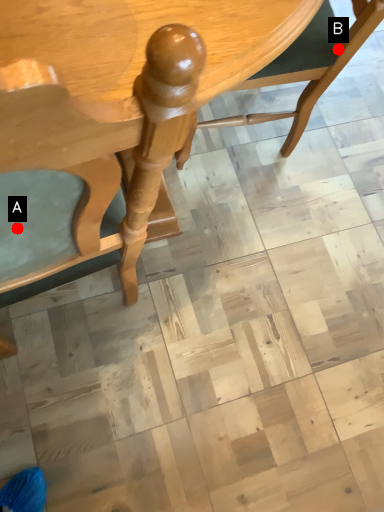
Question: Two points are circled on the image, labeled by A and B beside each circle. Which point is closer to the camera?

Choices:
 (A) A is closer
 (B) B is closer

Answer: (A)